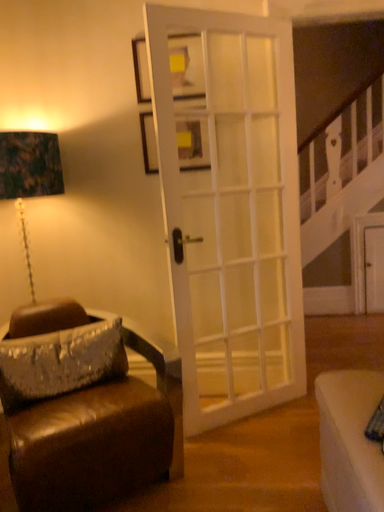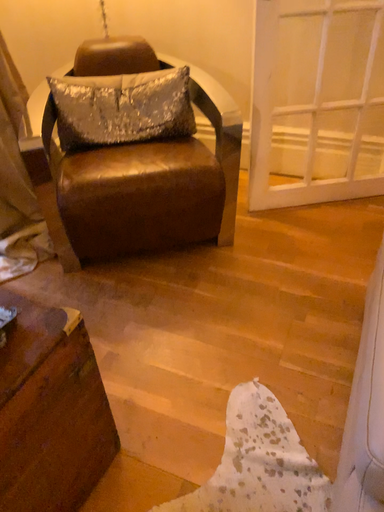
Question: How did the camera likely rotate when shooting the video?

Choices:
 (A) rotated left
 (B) rotated right

Answer: (A)